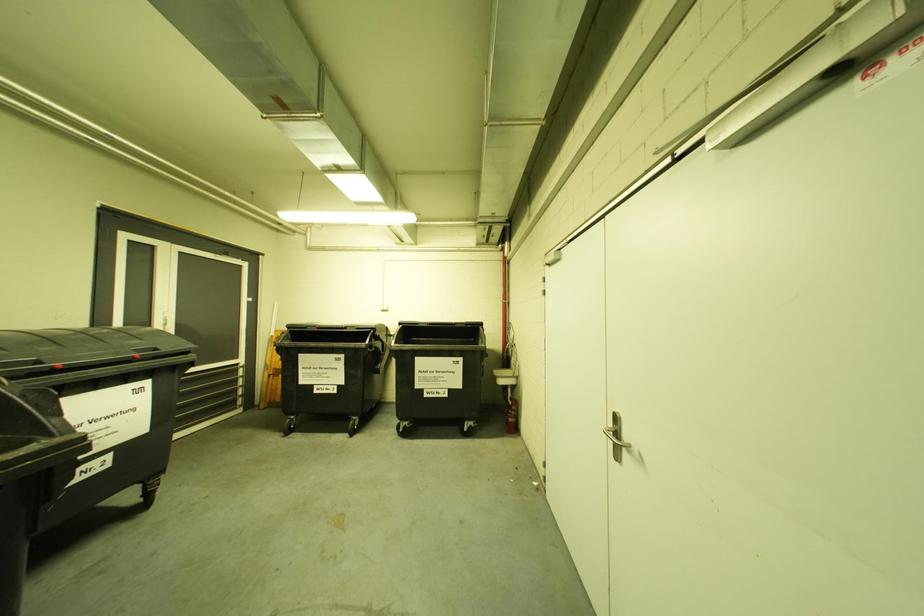
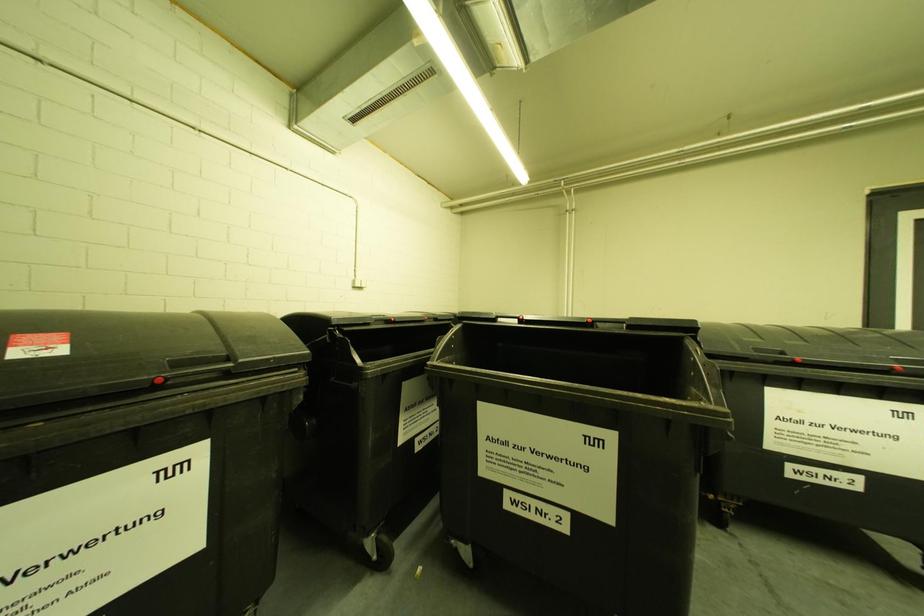
Question: The camera is either moving clockwise (left) or counter-clockwise (right) around the object. The first image is from the beginning of the video and the second image is from the end. Is the camera moving left or right when shooting the video?

Choices:
 (A) Left
 (B) Right

Answer: (B)